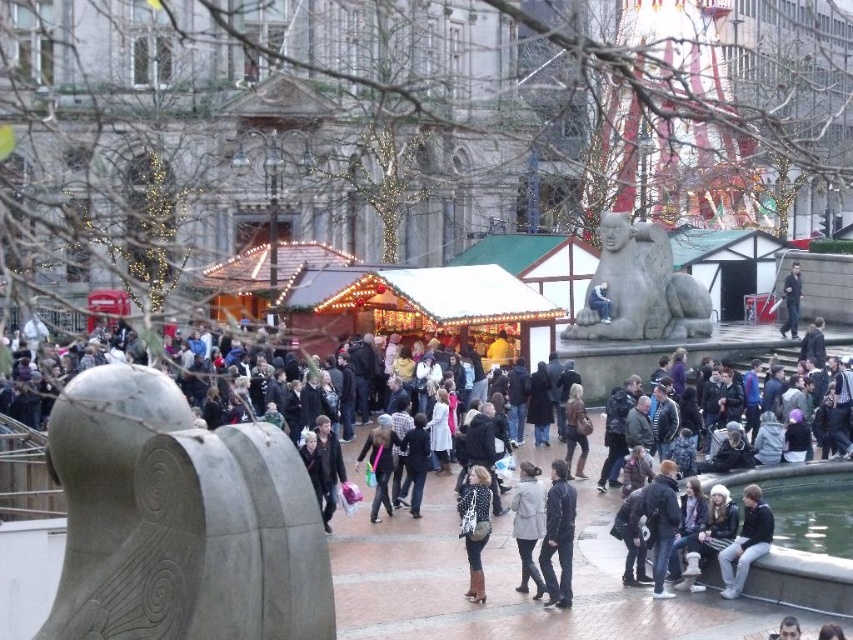
Question: Estimate the real-world distances between objects in this image. Which object is farther from the matte gray coat at center?

Choices:
 (A) leather jacket at center
 (B) gray stone sculpture at center

Answer: (B)

Question: Is gray stone sphinx at center further to the viewer compared to dark gray stone statue at lower right?

Choices:
 (A) no
 (B) yes

Answer: (B)

Question: Does gray stone sphinx at center appear under polka dot scarf at center?

Choices:
 (A) yes
 (B) no

Answer: (B)

Question: Can you confirm if gray stone sphinx at center is thinner than leather jacket at center?

Choices:
 (A) no
 (B) yes

Answer: (A)

Question: Among these points, which one is farthest from the camera?

Choices:
 (A) (369, 444)
 (B) (764, 524)
 (C) (543, 486)

Answer: (A)

Question: Which of these objects is positioned farthest from the matte gray coat at center?

Choices:
 (A) gray stone sculpture at center
 (B) gray stone sphinx at center
 (C) leather jacket at center

Answer: (B)